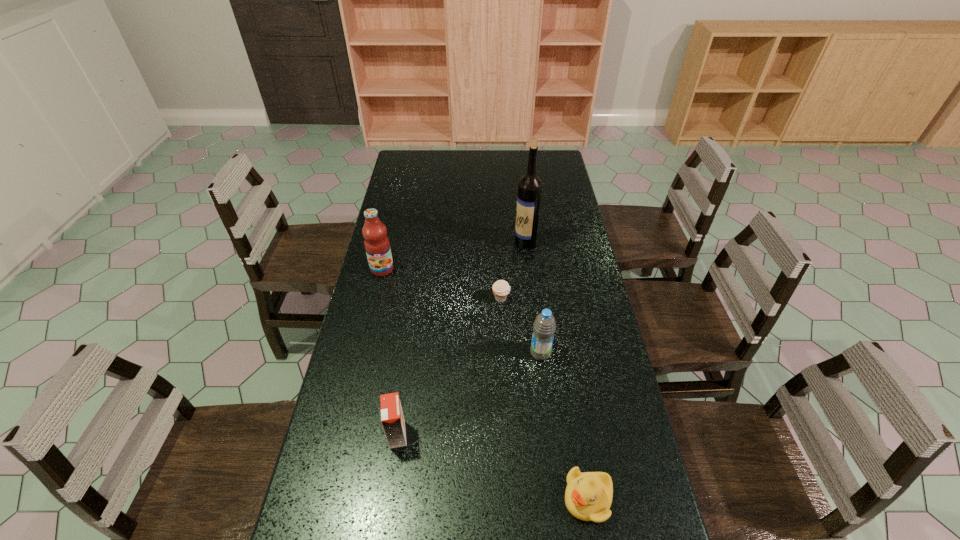
Where is `vacant point located between the muffin and the nearest object`? The height and width of the screenshot is (540, 960). vacant point located between the muffin and the nearest object is located at coordinates [544, 399].

Where is `vacant area between the orange juice and the fruit juice`? The image size is (960, 540). vacant area between the orange juice and the fruit juice is located at coordinates (390, 352).

You are a GUI agent. You are given a task and a screenshot of the screen. Output one action in this format:
    pyautogui.click(x=<x>, y=<y>)
    Task: Click on the vacant area that lies between the third farthest object and the fruit juice
    The image size is (960, 540).
    Given the screenshot: What is the action you would take?
    pyautogui.click(x=442, y=284)

Locate an element on the screen. This screenshot has width=960, height=540. blank region between the fourth shortest object and the shortest object is located at coordinates (521, 326).

Image resolution: width=960 pixels, height=540 pixels. I want to click on unoccupied area between the muffin and the fifth shortest object, so click(442, 284).

Locate an element on the screen. free spot between the fifth shortest object and the shortest object is located at coordinates pos(442,284).

Locate an element on the screen. The image size is (960, 540). vacant space that's between the leftmost object and the shortest object is located at coordinates (442, 284).

Where is `free space between the nearest object and the leftmost object`? free space between the nearest object and the leftmost object is located at coordinates (485, 384).

Select which object appears as the fifth closest to the tallest object. Please provide its 2D coordinates. Your answer should be formatted as a tuple, i.e. [(x, y)], where the tuple contains the x and y coordinates of a point satisfying the conditions above.

[(588, 496)]

This screenshot has height=540, width=960. Identify the location of the second closest object to the fourth object from right to left. coord(530,185).